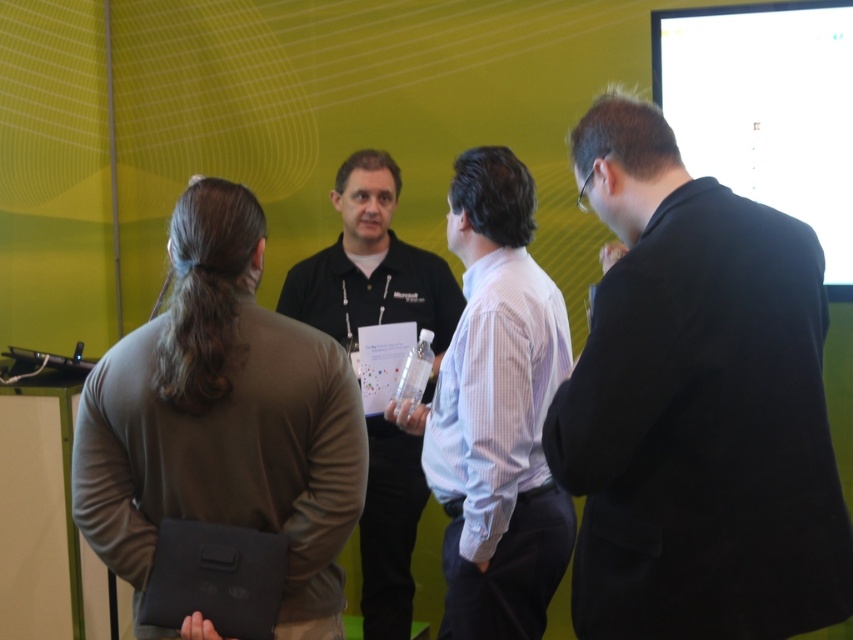
You are organizing a photo shoot and need to arrange two subjects, the black suit at right and the black shirt at center, in a line from left to right based on their current positions. What order should they be placed in?

The black shirt at center should be placed on the left side and the black suit at right should be placed on the right side since the black suit at right is positioned on the right side of the black shirt at center.

You are a photographer setting up for a group photo. You notice a brown matte laptop at left and a black shirt at center in the frame. Which object is closer to the camera?

The brown matte laptop at left is closer to the camera because it is positioned over the black shirt at center.

You are standing in the same room as the group and want to take a photo of both point (128, 531) and point (393, 628) in the image. Which point should you focus on first to ensure both are in focus?

To ensure both points are in focus, you should focus on point (128, 531) first since it is closer to the camera than point (393, 628). This way, the depth of field will extend from the closer point to the farther one, capturing both in focus.